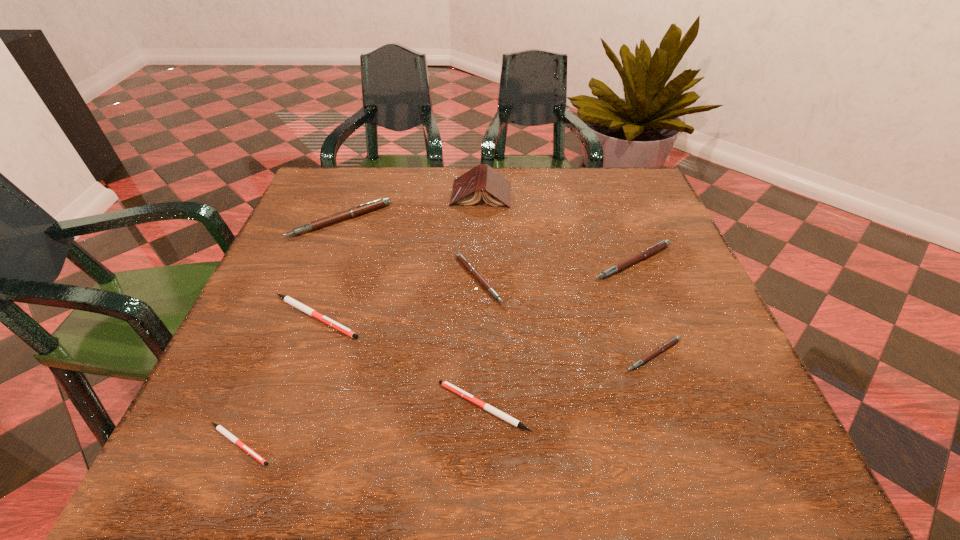
At what (x,y) coordinates should I click in order to perform the action: click on blank area located on the clicker of the rightmost white pen. Please return your answer as a coordinate pair (x, y). Image resolution: width=960 pixels, height=540 pixels. Looking at the image, I should click on (407, 407).

This screenshot has width=960, height=540. I want to click on vacant space located on the clicker of the smallest white pen, so click(x=468, y=444).

Find the location of a particular element. Image resolution: width=960 pixels, height=540 pixels. book that is at the far edge is located at coordinates (467, 189).

This screenshot has height=540, width=960. What are the coordinates of `pen located at the far edge` in the screenshot? It's located at (361, 209).

Find the location of `object that is at the far left corner`. object that is at the far left corner is located at coordinates (361, 209).

Identify the location of object that is positioned at the near left corner. (222, 430).

Locate an element on the screen. The image size is (960, 540). vacant space at the far edge of the desktop is located at coordinates (x=580, y=178).

Identify the location of free location at the near edge of the desktop. The height and width of the screenshot is (540, 960). (400, 435).

At what (x,y) coordinates should I click in order to perform the action: click on free space at the left edge. Please return your answer as a coordinate pair (x, y). The width and height of the screenshot is (960, 540). Looking at the image, I should click on (287, 362).

You are a GUI agent. You are given a task and a screenshot of the screen. Output one action in this format:
    pyautogui.click(x=<x>, y=<y>)
    Task: Click on the vacant space at the right edge of the desktop
    
    Given the screenshot: What is the action you would take?
    pyautogui.click(x=628, y=241)